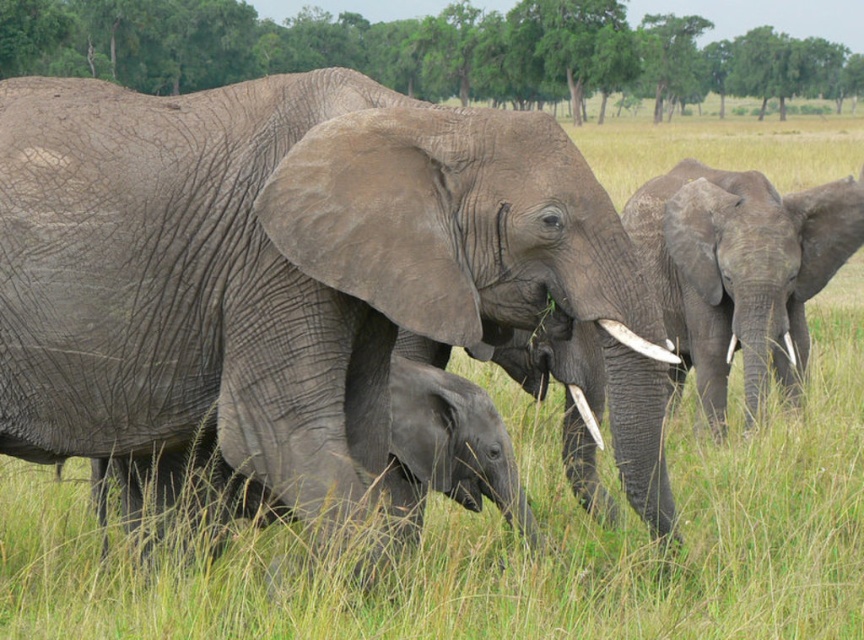
Does gray rough elephant at right have a smaller size compared to white ivory tusk at center?

No.

Is gray rough elephant at right to the left of white ivory tusk at center from the viewer's perspective?

In fact, gray rough elephant at right is to the right of white ivory tusk at center.

Who is more distant from viewer, [638,209] or [655,342]?

The point [638,209] is behind.

Identify the location of gray rough elephant at right. (x=740, y=269).

Does point (723, 428) come closer to viewer compared to point (591, 433)?

That is False.

Who is positioned more to the left, gray rough elephant at right or white glossy tusk at lower right?

white glossy tusk at lower right is more to the left.

Where is `gray rough elephant at right`? gray rough elephant at right is located at coordinates (740, 269).

Is gray rough elephant at right further to the viewer compared to gray matte/skin-like baby elephant at center?

Yes, gray rough elephant at right is further from the viewer.

The image size is (864, 640). What are the coordinates of `gray rough elephant at right` in the screenshot? It's located at (740, 269).